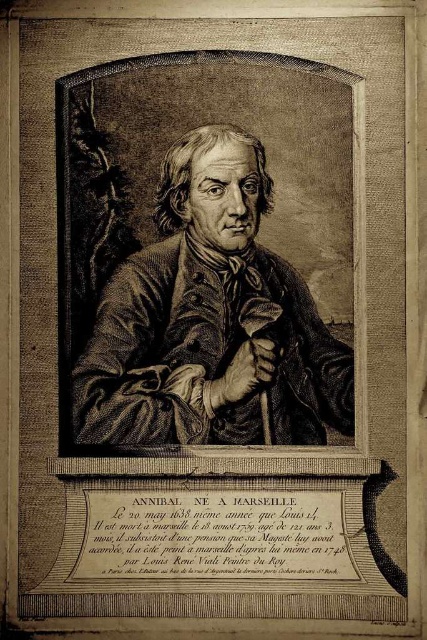
Between etched paper portrait at center and black paper text at center, which one appears on the left side from the viewer's perspective?

etched paper portrait at center is more to the left.

Can you confirm if etched paper portrait at center is positioned below black paper text at center?

No, etched paper portrait at center is not below black paper text at center.

Which is behind, point (222, 385) or point (143, 516)?

Point (143, 516)

Where is `etched paper portrait at center`? etched paper portrait at center is located at coordinates (210, 321).